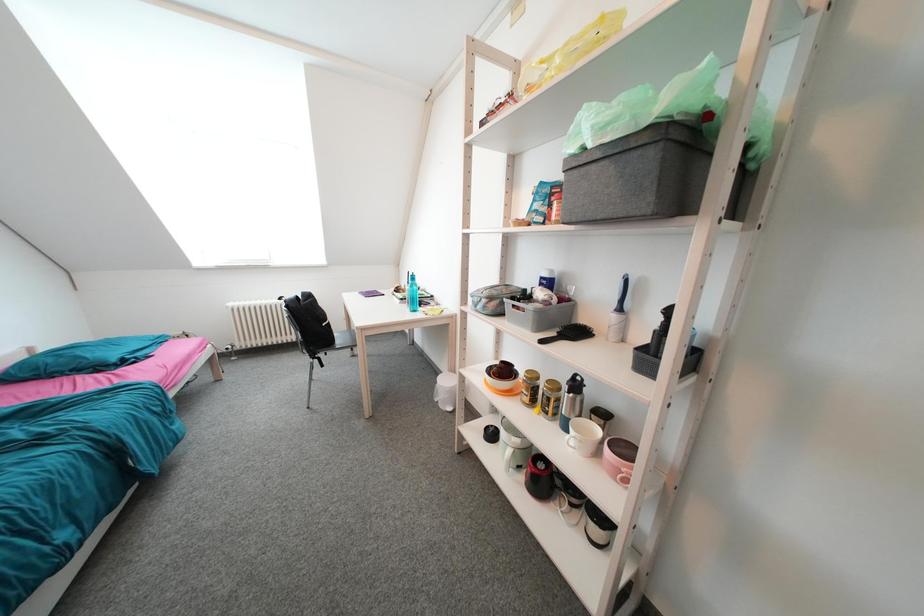
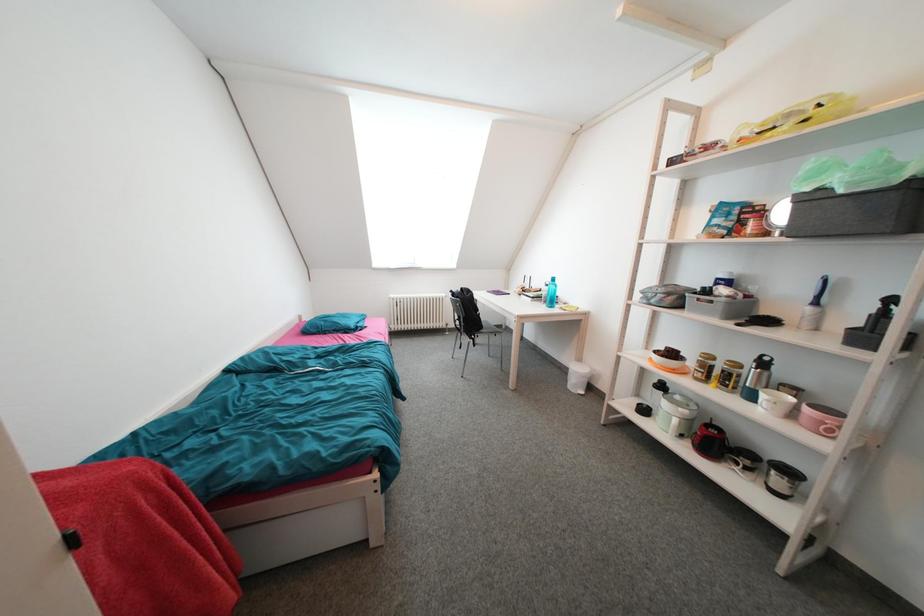
Question: The images are taken continuously from a first-person perspective. In which direction is your viewpoint rotating?

Choices:
 (A) Left
 (B) Right
 (C) Up
 (D) Down

Answer: (A)